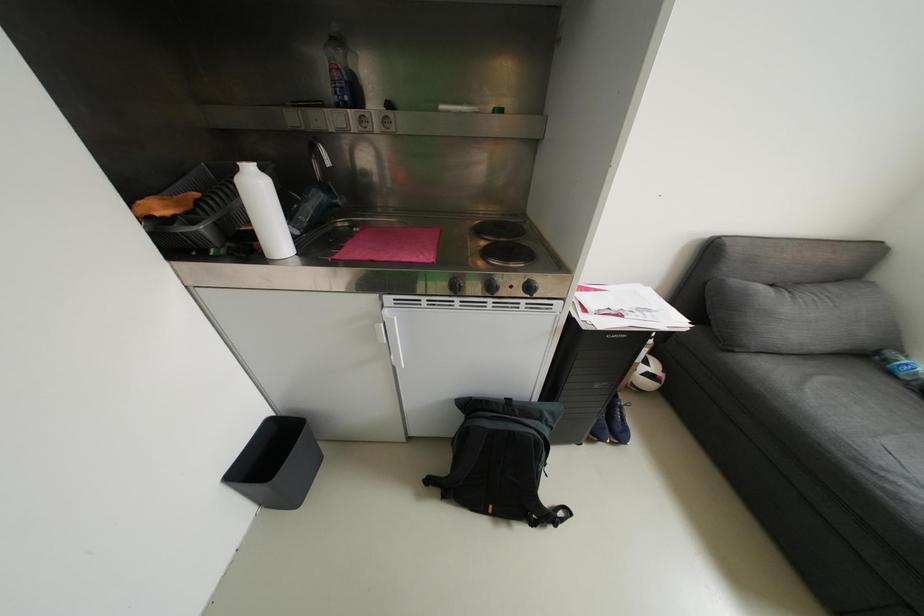
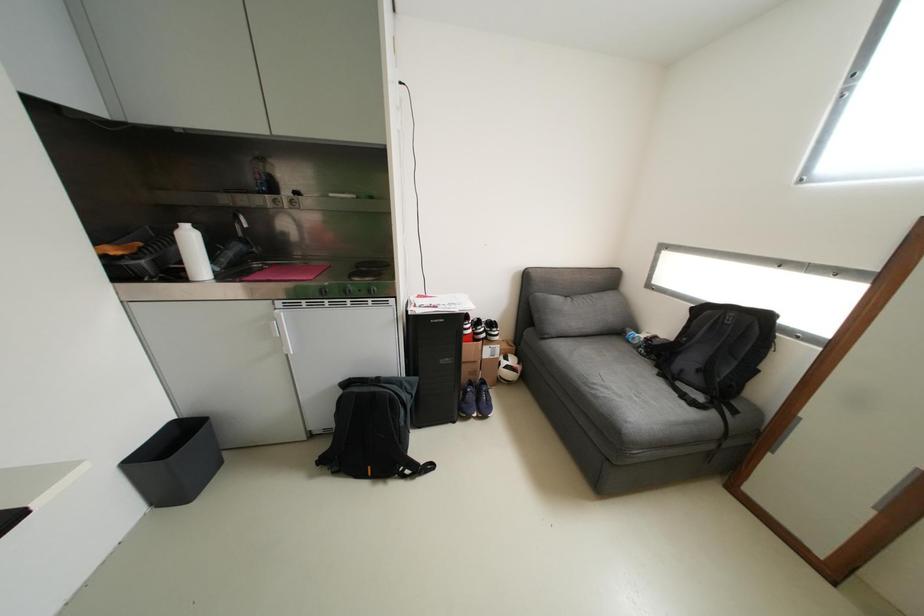
In a continuous first-person perspective shot, in which direction is the camera moving?

The movement direction of the cameraman is right, backward.